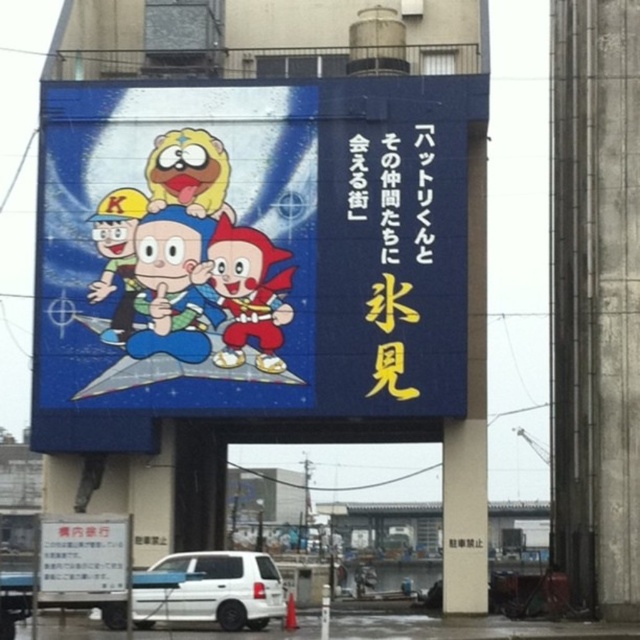
You are a delivery driver who needs to load a shiny red helmet at center into the white matte van at lower center. Based on the scene, will the helmet fit vertically inside the van?

The white matte van at lower center is taller than the shiny red helmet at center, so the helmet will fit vertically inside the van.

You are a delivery driver who needs to load a shiny red helmet at center into your white matte van at lower center. Based on the scene, will the helmet fit inside the van?

The white matte van at lower center has a larger size compared to shiny red helmet at center, so the helmet should fit inside the van.